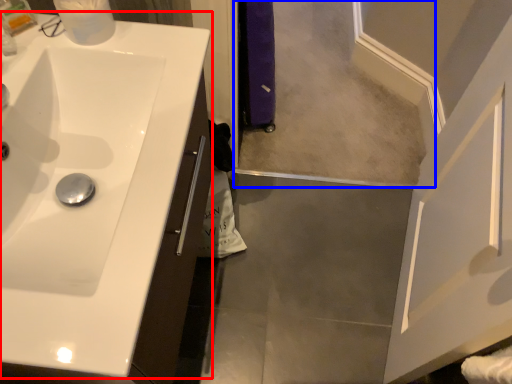
Question: Which of the following is the closest to the observer, sink (highlighted by a red box) or mirror (highlighted by a blue box)?

Choices:
 (A) sink
 (B) mirror

Answer: (A)